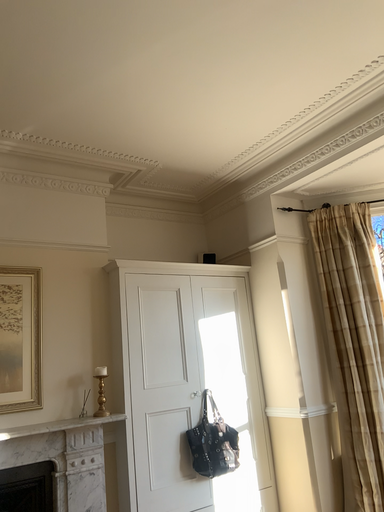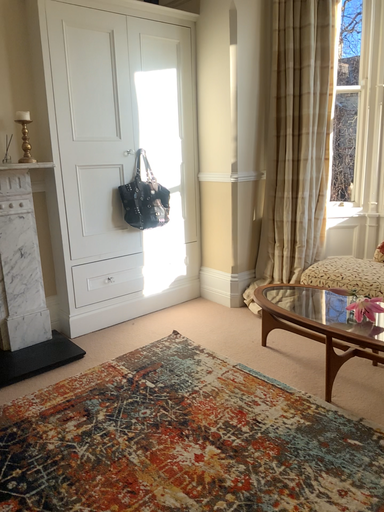
Question: How did the camera likely rotate when shooting the video?

Choices:
 (A) rotated left
 (B) rotated right

Answer: (B)